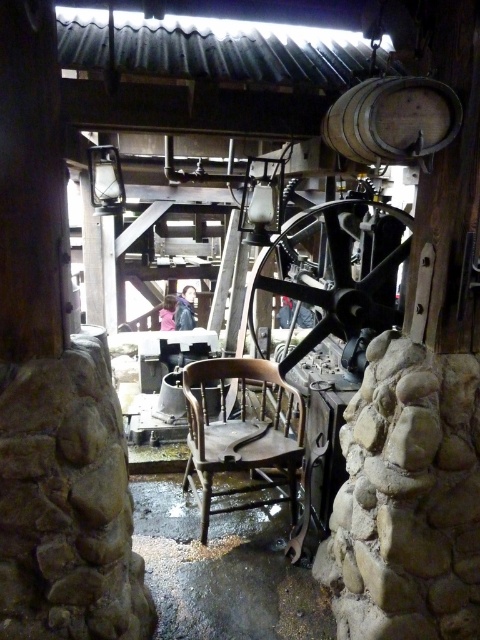
You are an interior designer planning to place a new rug in the rustic mill workshop. The wooden chair at center and the wooden barrel at upper center are in the way. Which object needs to be moved first to accommodate the rug, considering their sizes?

The wooden chair at center needs to be moved first because it is bigger than the wooden barrel at upper center, so it occupies more space and would require more clearance for the rug.

You are standing in the center of the room and want to move towards the wooden chair at center. According to the coordinates provided, in which direction should you move to reach it?

The wooden chair at center is located at coordinates point (x=242, y=433). Since you are at the center of the room, you should move towards the right and slightly forward to reach the wooden chair at center.